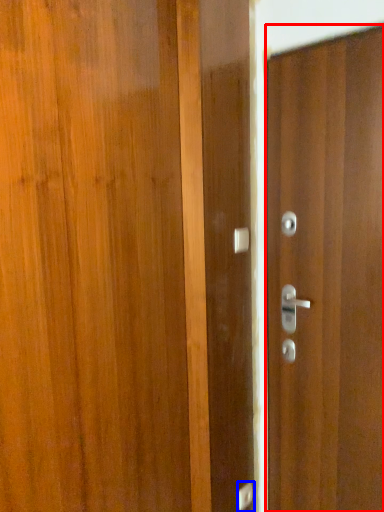
Question: Which object is further to the camera taking this photo, door (highlighted by a red box) or door handle (highlighted by a blue box)?

Choices:
 (A) door
 (B) door handle

Answer: (B)